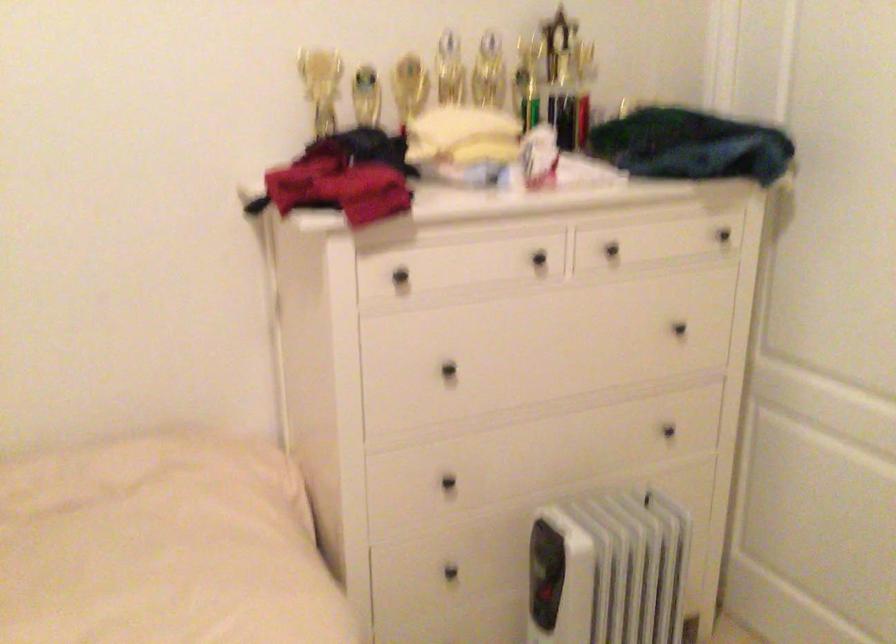
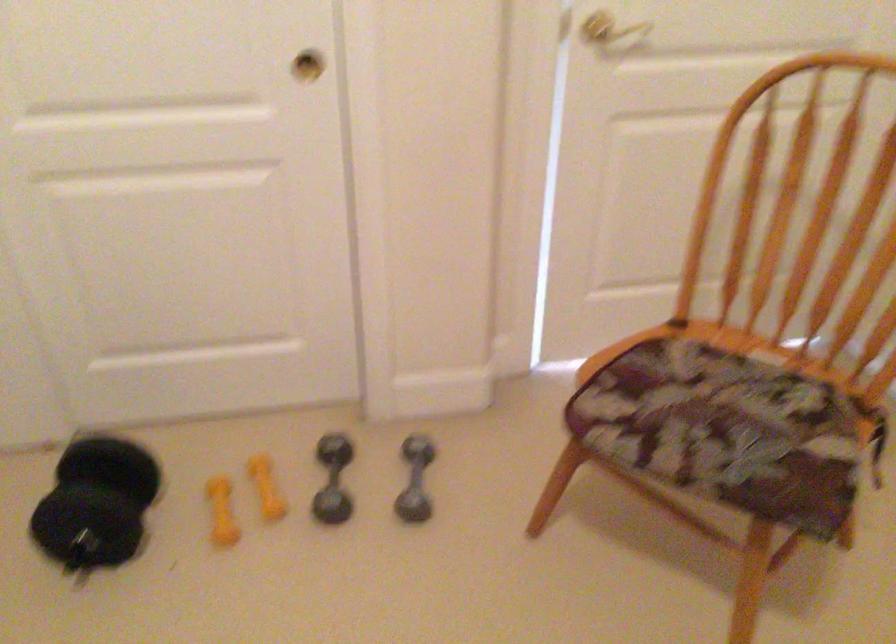
The images are taken continuously from a first-person perspective. In which direction is your viewpoint rotating?

The rotation direction of the camera is right-down.